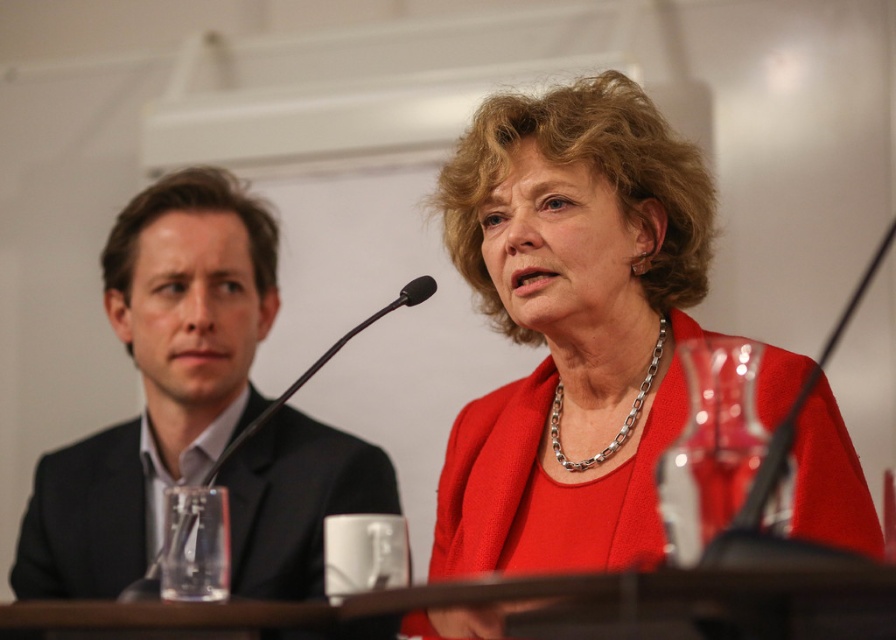
Is point (487, 461) in front of point (600, 451)?

No, (487, 461) is behind (600, 451).

In the scene shown: Is matte red blazer at center further to camera compared to silver chain necklace at center?

No, matte red blazer at center is closer to the viewer.

Which is in front, point (440, 566) or point (592, 467)?

Point (592, 467) is in front.

At what (x,y) coordinates should I click in order to perform the action: click on matte red blazer at center. Please return your answer as a coordinate pair (x, y). Looking at the image, I should click on (571, 324).

Who is lower down, matte red blazer at center or matte black suit at left?

matte black suit at left is below.

Which is more to the left, matte red blazer at center or matte black suit at left?

matte black suit at left is more to the left.

Does point (610, 252) lie behind point (263, 515)?

No, (610, 252) is closer to viewer.

Locate an element on the screen. matte red blazer at center is located at coordinates (571, 324).

Between point (233, 328) and point (560, 444), which one is positioned behind?

The point (233, 328) is behind.

Is matte black suit at left bigger than silver chain necklace at center?

Yes, matte black suit at left is bigger than silver chain necklace at center.

Between point (196, 257) and point (643, 381), which one is positioned in front?

Positioned in front is point (643, 381).

The width and height of the screenshot is (896, 640). I want to click on matte black suit at left, so click(157, 380).